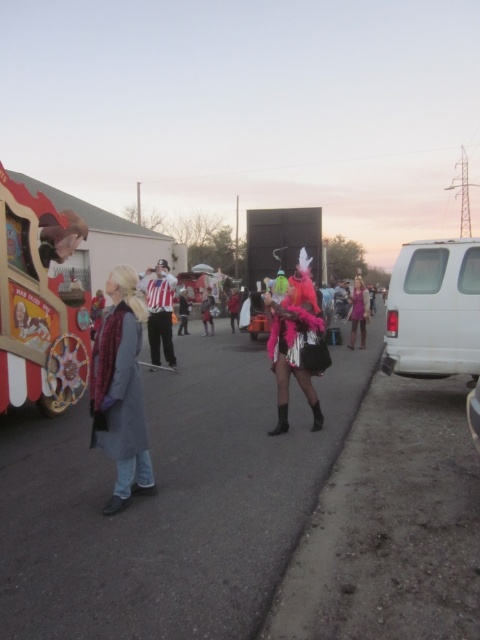
Question: Which of the following is the closest to the observer?

Choices:
 (A) denim jacket at lower left
 (B) wooden painted food truck at left

Answer: (A)

Question: Can you confirm if wooden painted food truck at left is positioned to the left of denim jacket at lower left?

Choices:
 (A) no
 (B) yes

Answer: (B)

Question: Can you confirm if denim jacket at lower left is wider than purple satin dress at center?

Choices:
 (A) no
 (B) yes

Answer: (B)

Question: Which point appears farthest from the camera in this image?

Choices:
 (A) (13, 348)
 (B) (170, 314)
 (C) (367, 300)

Answer: (C)

Question: Can you confirm if denim jacket at lower left is smaller than fuzzy pink costume at center?

Choices:
 (A) yes
 (B) no

Answer: (B)

Question: Which object appears closest to the camera in this image?

Choices:
 (A) denim jacket at lower left
 (B) fuzzy pink costume at center

Answer: (A)